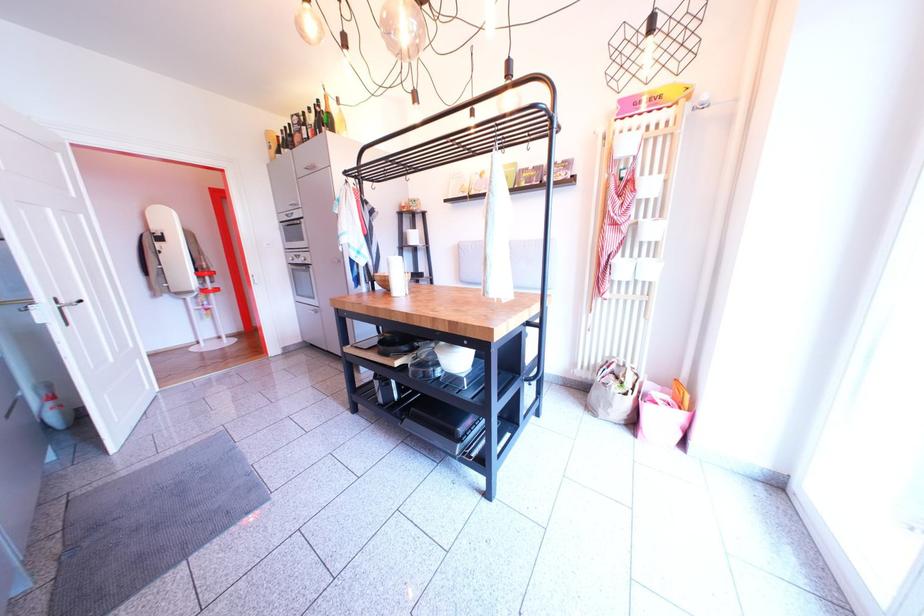
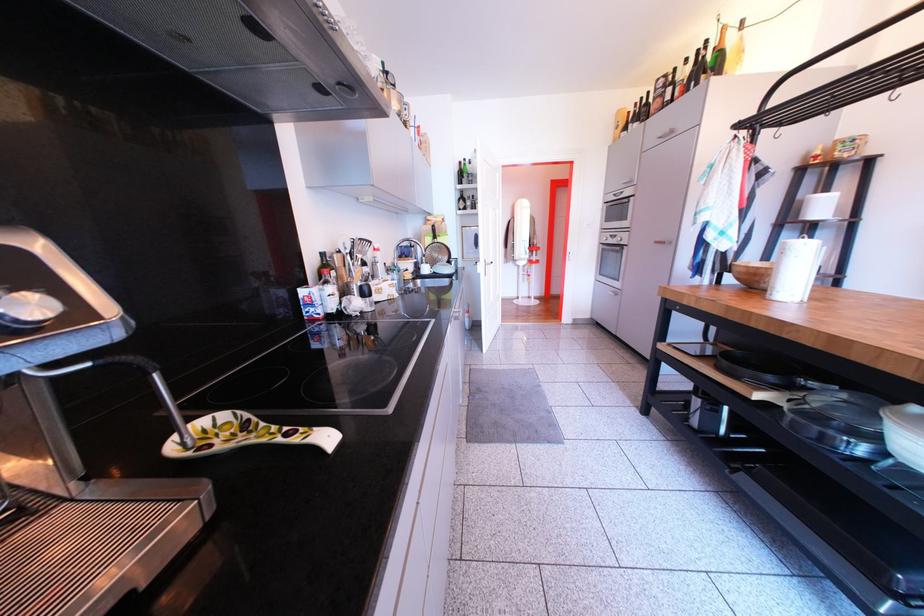
Question: The camera is either moving clockwise (left) or counter-clockwise (right) around the object. The first image is from the beginning of the video and the second image is from the end. Is the camera moving left or right when shooting the video?

Choices:
 (A) Left
 (B) Right

Answer: (B)